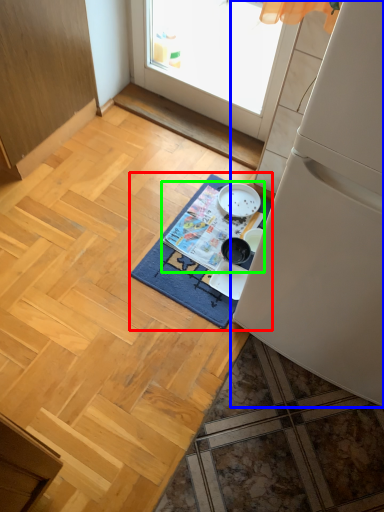
Question: Which object is positioned farthest from mat (highlighted by a red box)? Select from refrigerator (highlighted by a blue box) and magazine (highlighted by a green box).

Choices:
 (A) refrigerator
 (B) magazine

Answer: (A)